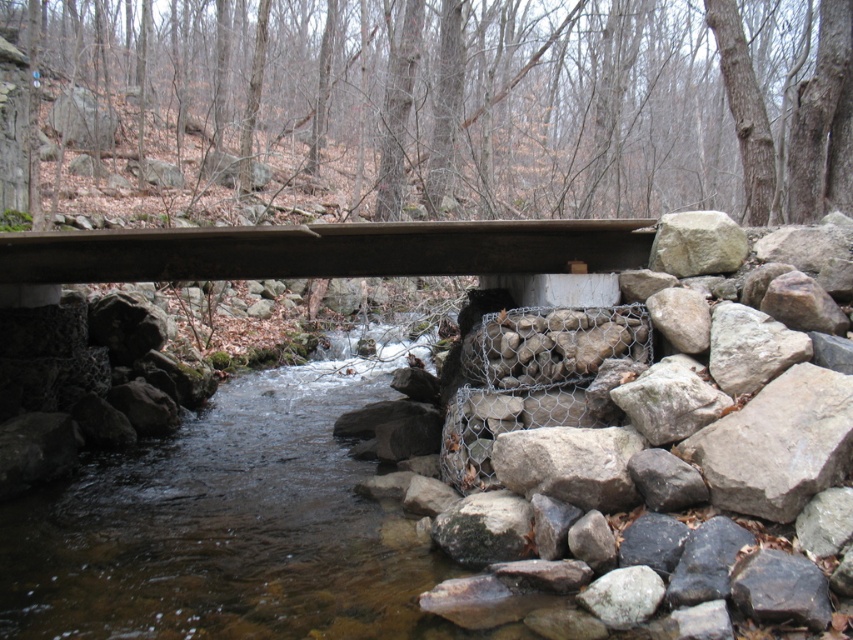
Which is in front, point (358, 269) or point (724, 227)?

Positioned in front is point (724, 227).

Locate an element on the screen. The image size is (853, 640). brown wooden bridge at center is located at coordinates (323, 250).